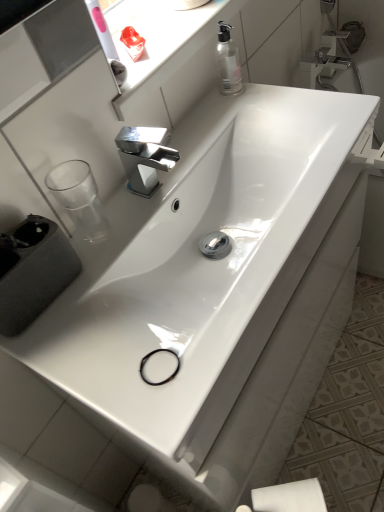
Locate an element on the screen. vacant region in front of polished chrome faucet at center is located at coordinates (133, 246).